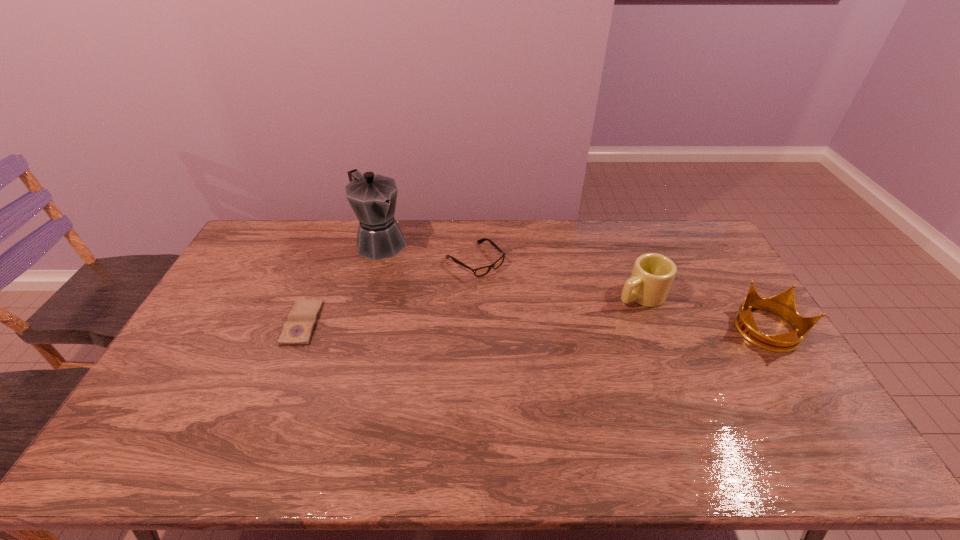
Locate an element on the screen. The height and width of the screenshot is (540, 960). vacant space on the desktop that is between the diary and the crown and is positioned with the handle on the side of the mug is located at coordinates (577, 327).

At what (x,y) coordinates should I click in order to perform the action: click on free spot on the desktop that is between the shortest object and the crown and is positioned on the front-facing side of the fourth tallest object. Please return your answer as a coordinate pair (x, y). This screenshot has height=540, width=960. Looking at the image, I should click on (554, 327).

Locate an element on the screen. vacant space on the desktop that is between the leftmost object and the rightmost object and is positioned at the spout of the coffeepot is located at coordinates (471, 326).